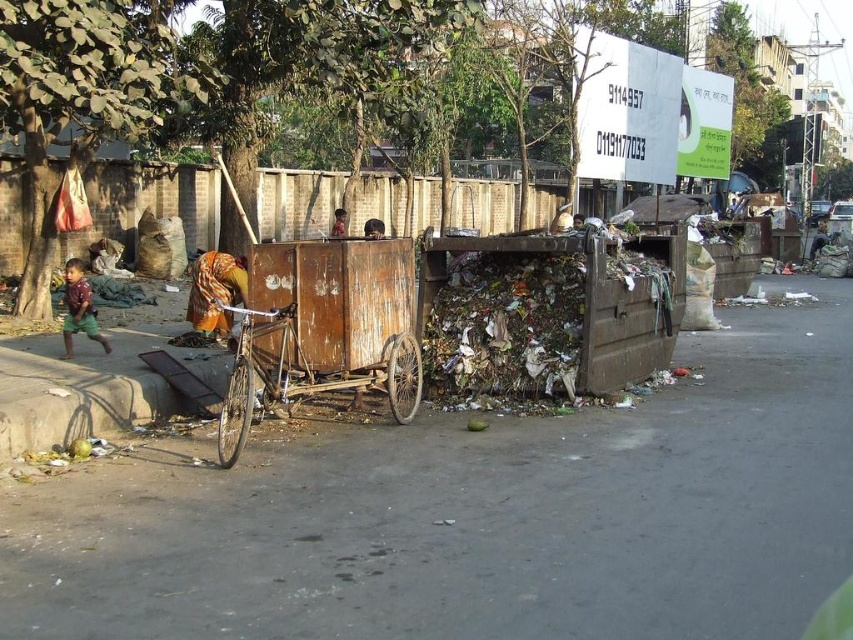
You are standing at the point labeled point (90,307) and want to walk to the point labeled point (96,499). Which direction should you face to move towards your destination?

You should face forward because point (96,499) is in front of point (90,307).

You are a delivery person trying to navigate through the street. There is a rusty wood cart at center and a matte brown shirt at left. Which object is closer to the left side of the street?

The matte brown shirt at left is closer to the left side of the street because the rusty wood cart at center is positioned to its right.